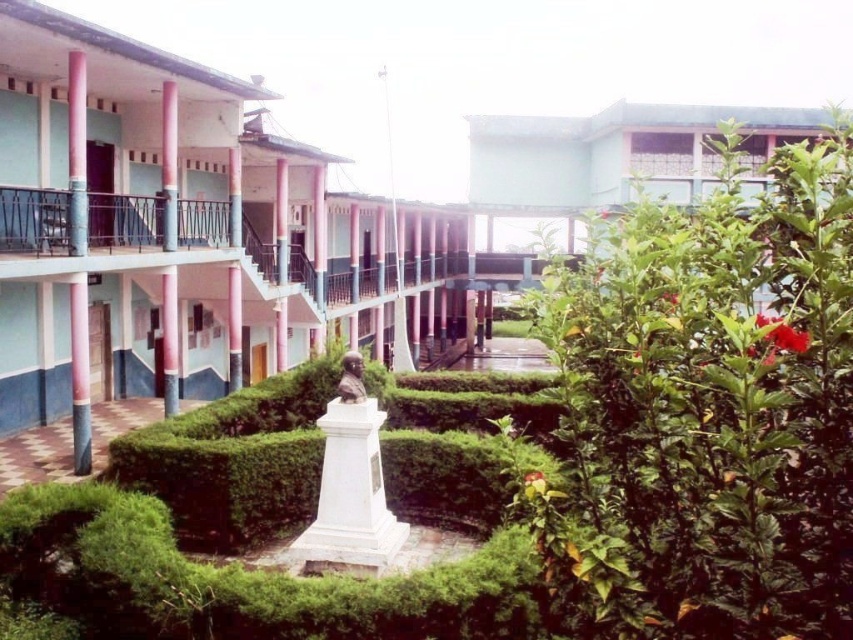
You are standing in the courtyard and want to place a new bench between the white marble statue at center and the pink glossy pole at left. The bench requires a space of 20 feet between the two objects to be placed safely. Can you place the bench there?

The distance between the white marble statue at center and the pink glossy pole at left is 30.23 feet, which is more than the required 20 feet. Therefore, the bench can be placed safely between them.

You are standing in the courtyard and want to reach the point marked at coordinates (776, 504). If you walk straight ahead, will you reach that point before walking 5 meters?

The distance between you and the point marked at coordinates (776, 504) is 4.87 meters, so yes, you will reach the point before walking 5 meters.

You are standing in the courtyard and want to place a 2.5 meter long bench in the courtyard. The green leafy bush at right is 5.09 meters away from you. Can you place the bench between you and the bush without it overlapping?

The green leafy bush at right is 5.09 meters away from you. Since the bench is 2.5 meters long, there is enough space between you and the bush to place it without overlapping.